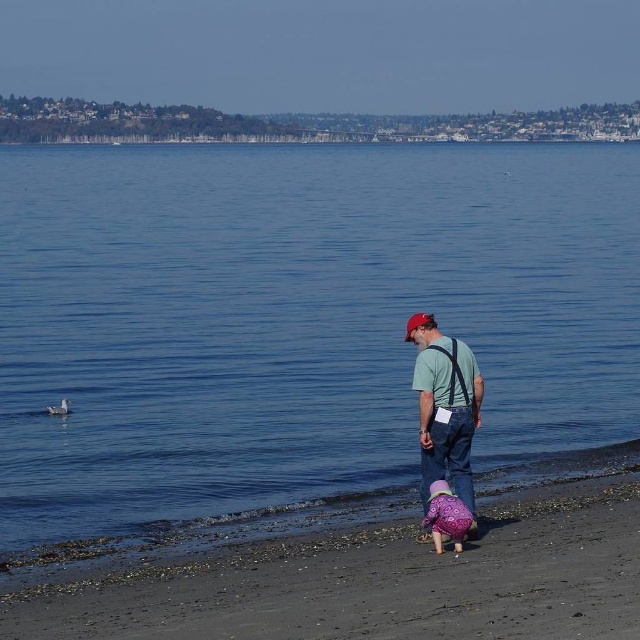
You are a photographer trying to capture a group photo of the matte green shirt at center and the purple fuzzy coat at lower center. If you want both subjects to appear equally sized in the photo, which subject should you move closer to the camera and by how much?

The purple fuzzy coat at lower center is smaller in width than the matte green shirt at center. To make them appear the same size in the photo, move the purple fuzzy coat at lower center closer to the camera by an amount that compensates for its smaller width compared to the matte green shirt at center.

You are a photographer trying to capture a wide shot of the dark brown sandy beach at lower center and the purple fuzzy coat at lower center. Which object will appear smaller in your photo?

The dark brown sandy beach at lower center appears smaller in the photo because it is described as smaller than the purple fuzzy coat at lower center.